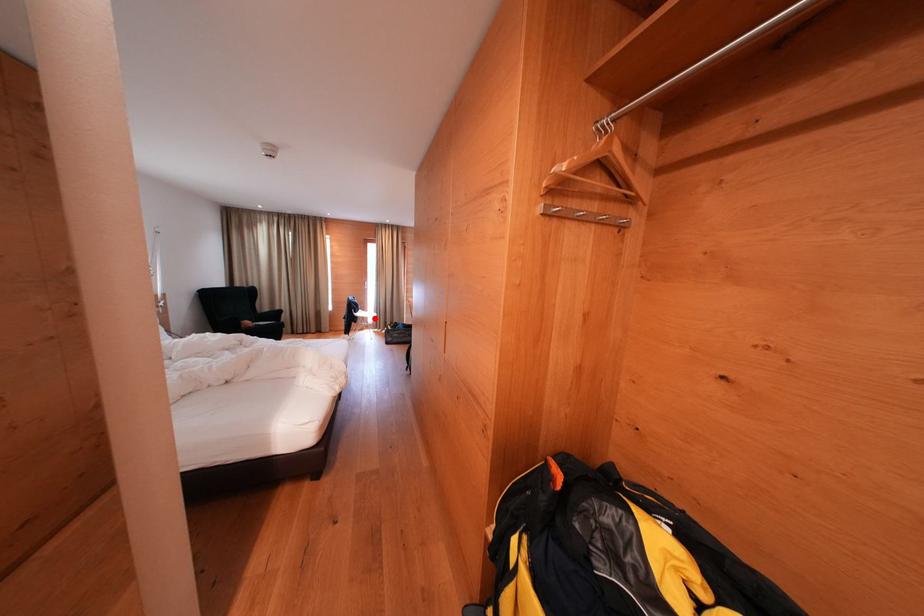
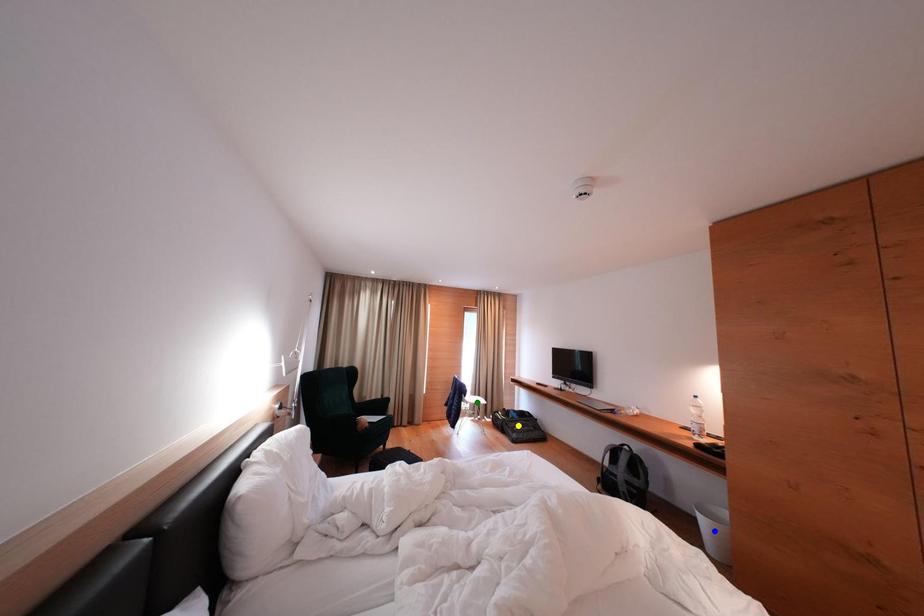
Question: I am providing you with two images of the same scene from different viewpoints. A red point is marked on the first image. You are given multiple points on the second image. Which spot in image 2 lines up with the point in image 1?

Choices:
 (A) blue point
 (B) green point
 (C) yellow point

Answer: (B)